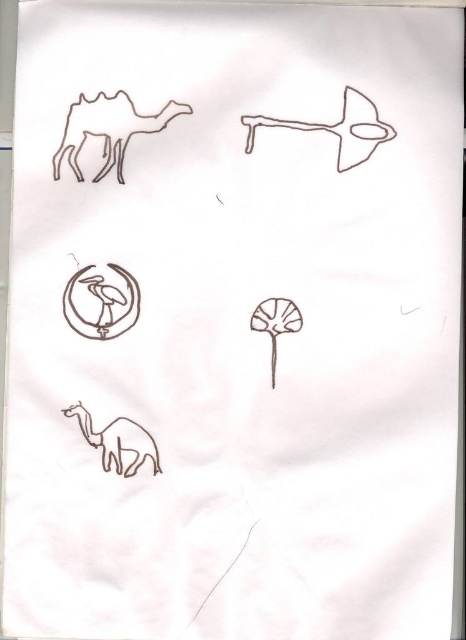
Question: Estimate the real-world distances between objects in this image. Which object is closer to the brown matte airplane at upper center?

Choices:
 (A) brown line art camel at lower left
 (B) brown matte camel at upper left

Answer: (B)

Question: Considering the relative positions of brown matte camel at upper left and brown line art camel at lower left in the image provided, where is brown matte camel at upper left located with respect to brown line art camel at lower left?

Choices:
 (A) above
 (B) below

Answer: (A)

Question: Which object appears closest to the camera in this image?

Choices:
 (A) brown matte camel at upper left
 (B) brown line art camel at lower left
 (C) brown matte airplane at upper center

Answer: (C)

Question: Estimate the real-world distances between objects in this image. Which object is farther from the brown line art camel at lower left?

Choices:
 (A) brown matte airplane at upper center
 (B) brown matte camel at upper left

Answer: (A)

Question: Can you confirm if brown matte camel at upper left is positioned to the left of brown matte airplane at upper center?

Choices:
 (A) yes
 (B) no

Answer: (A)

Question: Does brown matte camel at upper left have a larger size compared to brown line art camel at lower left?

Choices:
 (A) yes
 (B) no

Answer: (A)